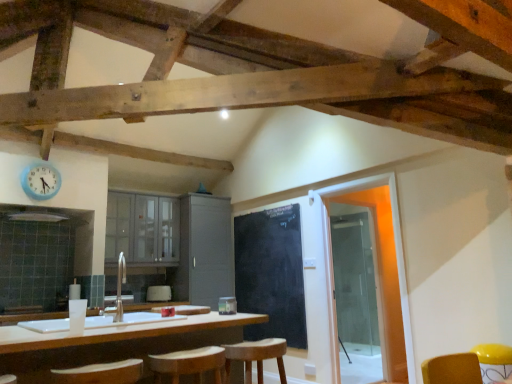
Question: In terms of height, does white glossy sink at center look taller or shorter compared to wooden bar stool at center?

Choices:
 (A) short
 (B) tall

Answer: (B)

Question: Looking at their shapes, would you say white glossy sink at center is wider or thinner than wooden bar stool at center?

Choices:
 (A) wide
 (B) thin

Answer: (A)

Question: Considering the real-world distances, which object is closest to the matte gray cabinets at center, which is counted as the 2th cabinetry, starting from the right?

Choices:
 (A) black chalkboard at center
 (B) white matte countertop at center
 (C) white fabric armchair at center
 (D) white glossy sink at center
 (E) transparent glass door at right

Answer: (C)

Question: Which is farther from the matte gray cabinets at center, which is counted as the 2th cabinetry, starting from the right?

Choices:
 (A) blue plastic clock at upper left
 (B) black chalkboard at center
 (C) wooden bar stool at center
 (D) white fabric armchair at center
 (E) white glossy sink at center

Answer: (C)